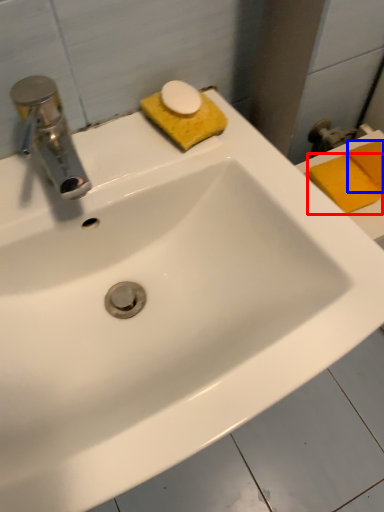
Question: Among these objects, which one is nearest to the camera, soap (highlighted by a red box) or soap (highlighted by a blue box)?

Choices:
 (A) soap
 (B) soap

Answer: (A)